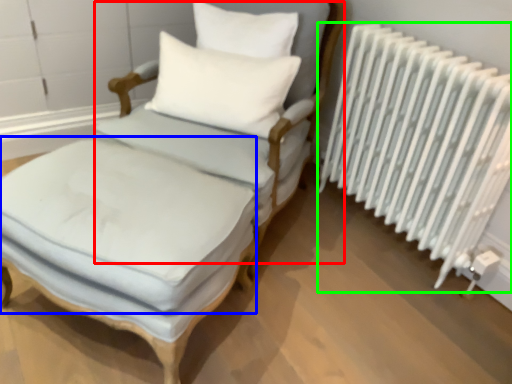
Question: Based on their relative distances, which object is farther from armchair (highlighted by a red box)? Choose from mattress (highlighted by a blue box) and radiator (highlighted by a green box).

Choices:
 (A) mattress
 (B) radiator

Answer: (B)